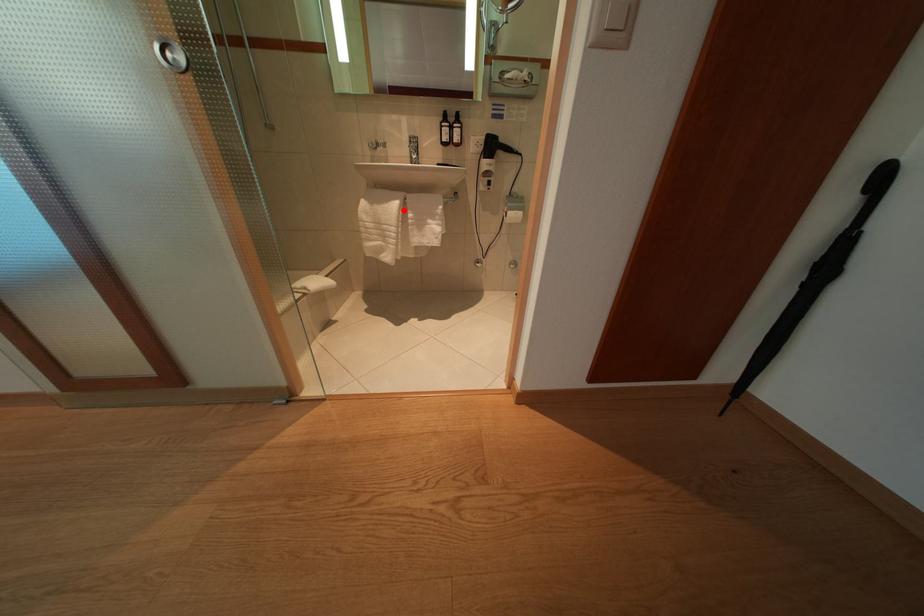
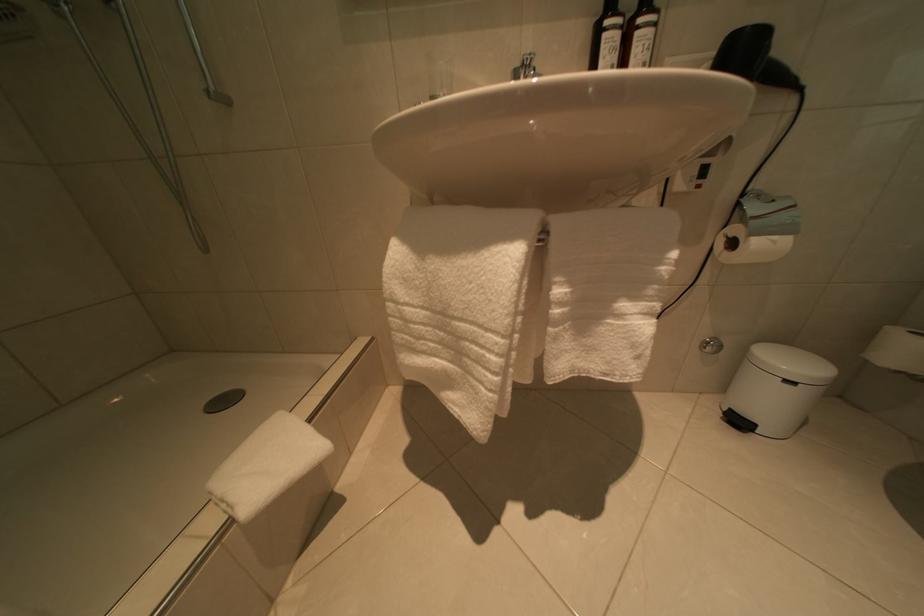
The point at the highlighted location is marked in the first image. Where is the corresponding point in the second image?

(517, 262)